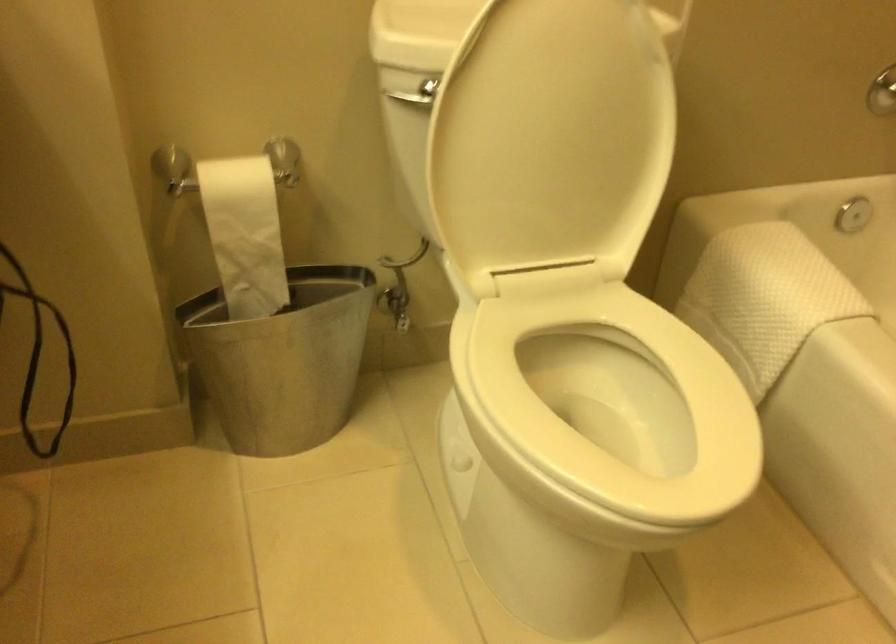
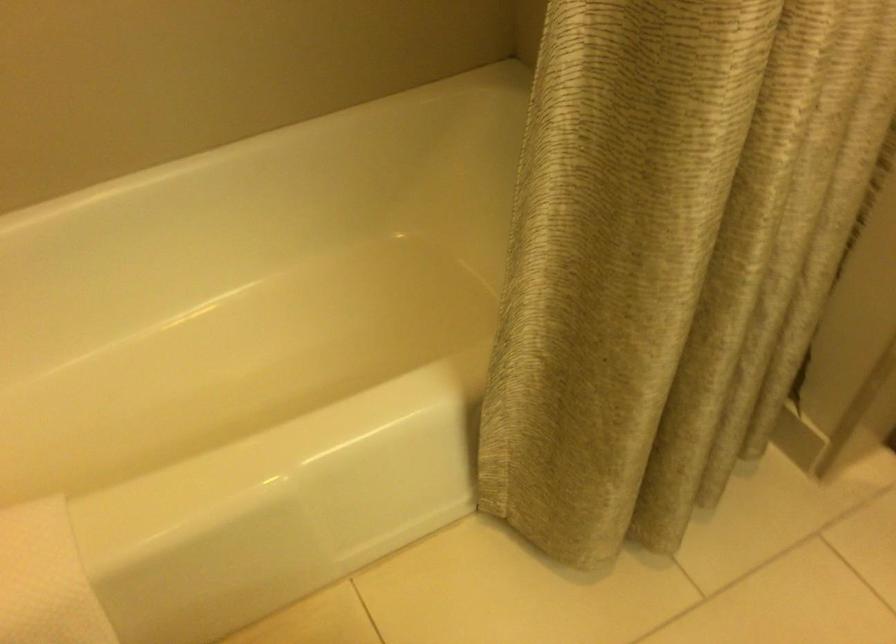
The point at (810, 308) is marked in the first image. Where is the corresponding point in the second image?

(46, 579)